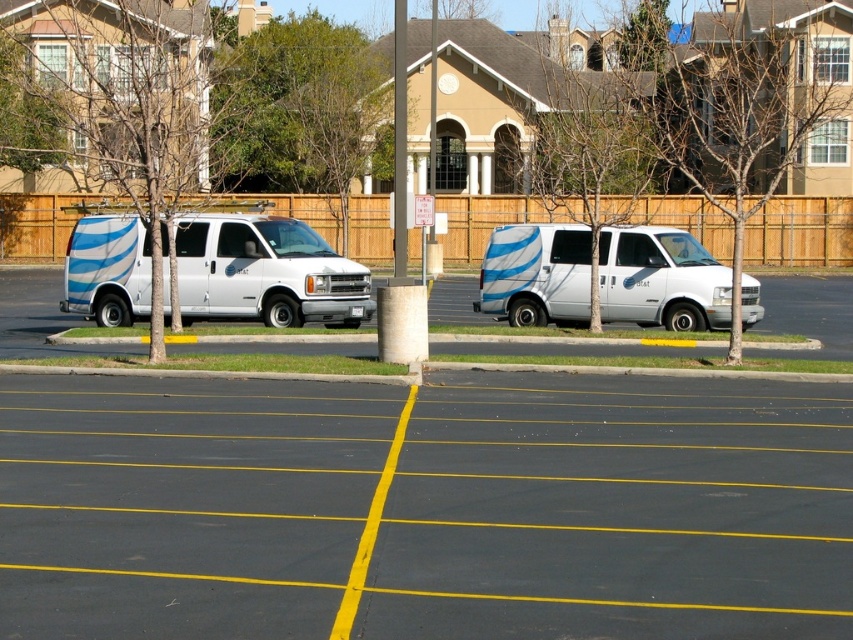
From the picture: Can you confirm if white matte van at left is smaller than white glossy van at center?

Incorrect, white matte van at left is not smaller in size than white glossy van at center.

At what (x,y) coordinates should I click in order to perform the action: click on white matte van at left. Please return your answer as a coordinate pair (x, y). The image size is (853, 640). Looking at the image, I should click on (425, 508).

Where is `white matte van at left`? white matte van at left is located at coordinates (425, 508).

Where is `white matte van at left`? The height and width of the screenshot is (640, 853). white matte van at left is located at coordinates (425, 508).

Who is shorter, white glossy van at left or white glossy van at center?

With less height is white glossy van at center.

Describe the element at coordinates (265, 272) in the screenshot. I see `white glossy van at left` at that location.

The width and height of the screenshot is (853, 640). Find the location of `white glossy van at left`. white glossy van at left is located at coordinates (265, 272).

The image size is (853, 640). Describe the element at coordinates (425, 508) in the screenshot. I see `white matte van at left` at that location.

Can you confirm if white matte van at left is positioned to the right of white glossy van at left?

Correct, you'll find white matte van at left to the right of white glossy van at left.

Between point (834, 593) and point (228, 266), which one is positioned in front?

Point (834, 593)

Find the location of `white matte van at left`. white matte van at left is located at coordinates coord(425,508).